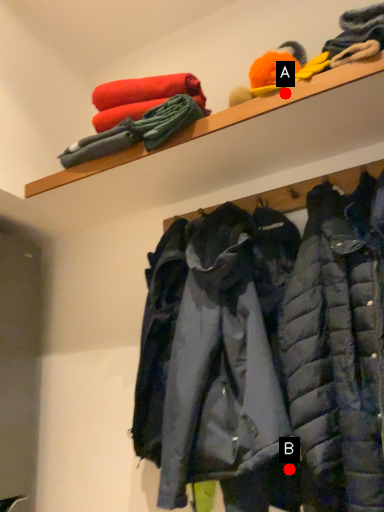
Question: Two points are circled on the image, labeled by A and B beside each circle. Which point appears closest to the camera in this image?

Choices:
 (A) A is closer
 (B) B is closer

Answer: (B)